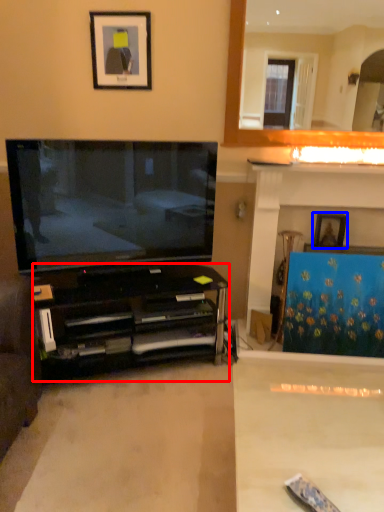
Question: Which object appears farthest to the camera in this image, cabinetry (highlighted by a red box) or picture frame (highlighted by a blue box)?

Choices:
 (A) cabinetry
 (B) picture frame

Answer: (B)